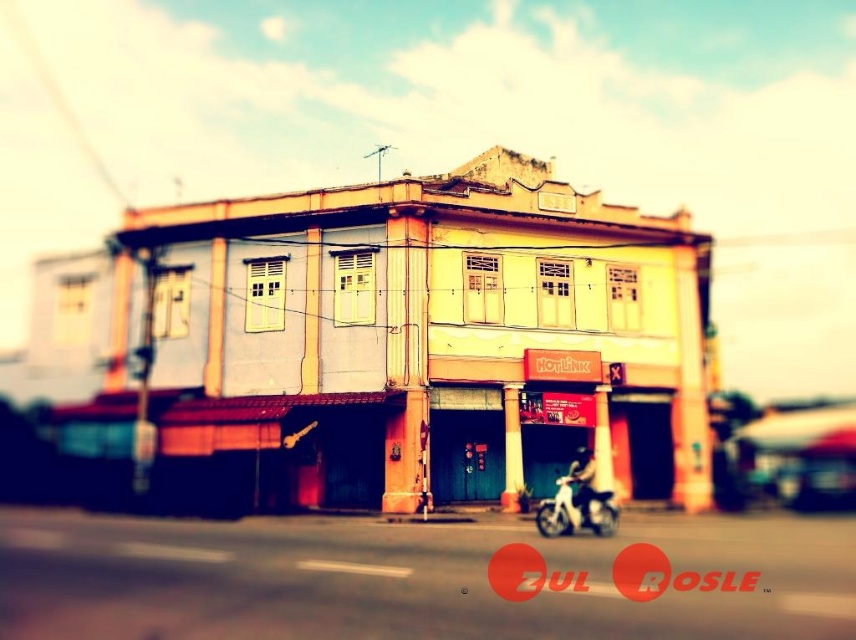
The image size is (856, 640). What are the coordinates of `white matte motorcycle at lower center` in the screenshot? It's located at (577, 508).

This screenshot has width=856, height=640. What are the coordinates of `white matte motorcycle at lower center` in the screenshot? It's located at (577, 508).

In order to click on white matte motorcycle at lower center in this screenshot , I will do `click(577, 508)`.